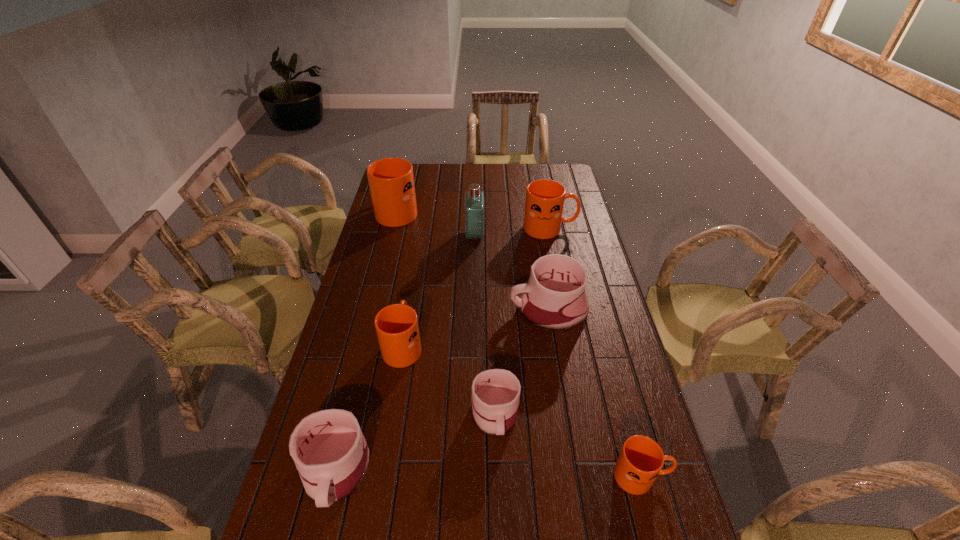
What are the coordinates of `vacant space at the far edge of the desktop` in the screenshot? It's located at (491, 163).

Find the location of a particular element. Image resolution: width=960 pixels, height=540 pixels. vacant space at the left edge of the desktop is located at coordinates (345, 347).

This screenshot has height=540, width=960. In order to click on vacant area at the right edge in this screenshot , I will do `click(603, 304)`.

Identify the location of unoccupied position between the sixth shortest object and the perfume. (513, 232).

At what (x,y) coordinates should I click in order to perform the action: click on free point between the tallest mug and the smallest orange mug. Please return your answer as a coordinate pair (x, y). The height and width of the screenshot is (540, 960). Looking at the image, I should click on (519, 343).

The height and width of the screenshot is (540, 960). Find the location of `free space that is in between the smallest white mug and the sixth shortest mug`. free space that is in between the smallest white mug and the sixth shortest mug is located at coordinates (523, 321).

Image resolution: width=960 pixels, height=540 pixels. In order to click on free space that is in between the leftmost white mug and the smallest orange mug in this screenshot , I will do `click(489, 473)`.

The image size is (960, 540). I want to click on free space between the leftmost white mug and the smallest orange mug, so click(489, 473).

Identify the location of unoccupied position between the nearest orange mug and the biggest orange mug. This screenshot has height=540, width=960. (519, 343).

You are a GUI agent. You are given a task and a screenshot of the screen. Output one action in this format:
    pyautogui.click(x=<x>, y=<y>)
    Task: Click on the object that is the seventh closest to the smallest white mug
    
    Given the screenshot: What is the action you would take?
    pyautogui.click(x=391, y=181)